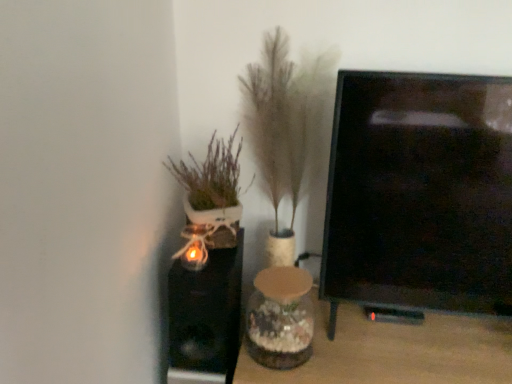
Identify the location of free space above clear glass vase at center (from a real-world perspective). (402, 334).